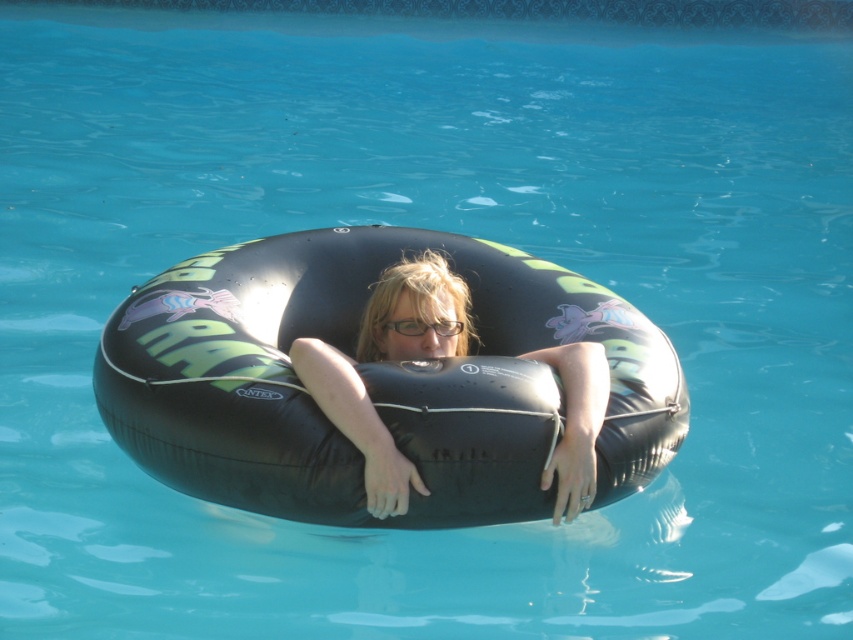
Does point (370, 448) come farther from viewer compared to point (426, 330)?

That is False.

Does black rubber tube at center appear over clear plastic glasses at center?

Correct, black rubber tube at center is located above clear plastic glasses at center.

Who is more forward, (x=442, y=289) or (x=462, y=324)?

Point (x=442, y=289) is in front.

Where is `black rubber tube at center`? The width and height of the screenshot is (853, 640). black rubber tube at center is located at coordinates (386, 358).